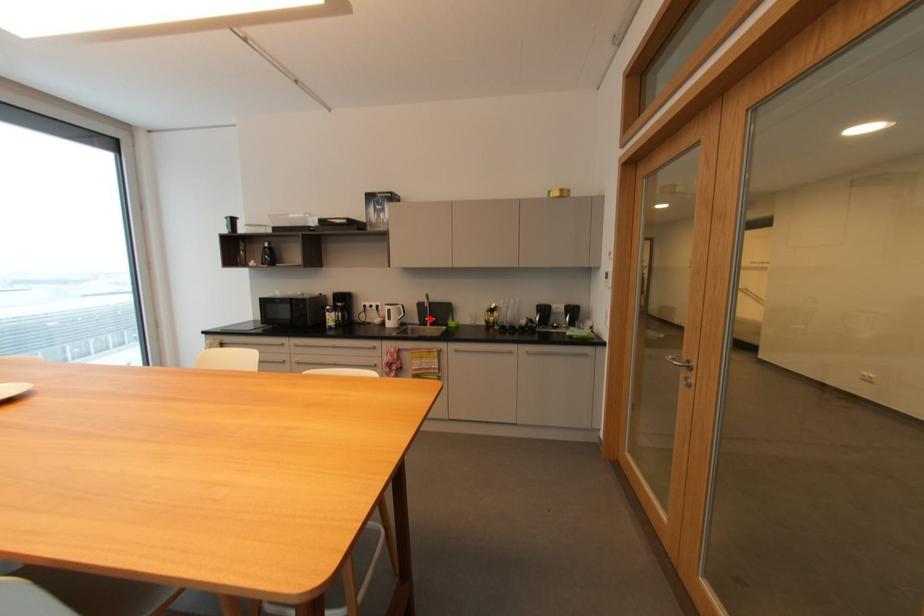
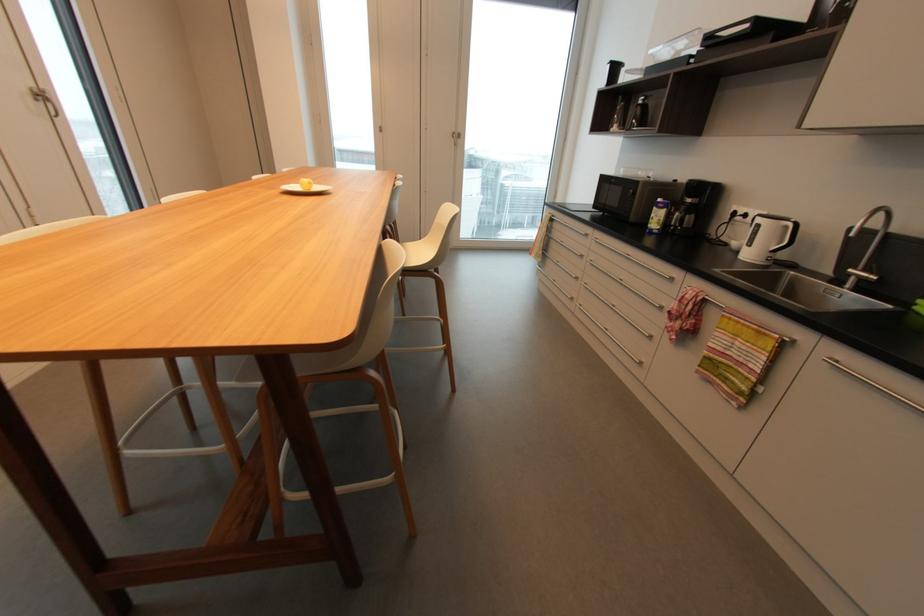
Locate, in the second image, the point that corresponds to the highlighted location in the first image.

(854, 270)